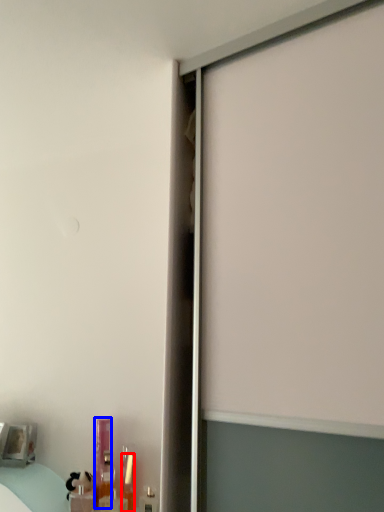
Question: Which object appears closest to the camera in this image, toiletry (highlighted by a red box) or toiletry (highlighted by a blue box)?

Choices:
 (A) toiletry
 (B) toiletry

Answer: (A)